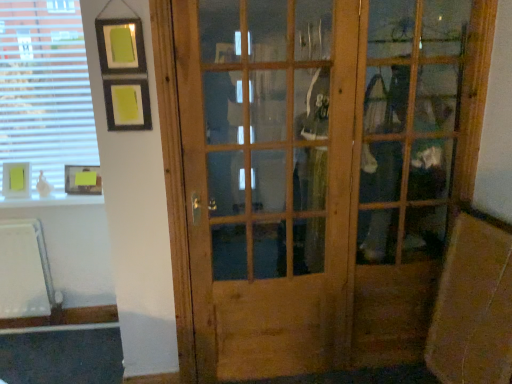
Question: Considering the positions of matte yellow picture frame at upper left, acting as the first picture frame starting from the left, and wooden door at center in the image, is matte yellow picture frame at upper left, acting as the first picture frame starting from the left, taller or shorter than wooden door at center?

Choices:
 (A) tall
 (B) short

Answer: (B)

Question: Does point (25, 183) appear closer or farther from the camera than point (452, 59)?

Choices:
 (A) farther
 (B) closer

Answer: (A)

Question: Which object is the closest to the matte yellow picture frame at upper left, placed as the second picture frame when sorted from right to left?

Choices:
 (A) white blinds at upper left
 (B) wooden door at center
 (C) yellow paper at lower left, the second picture frame positioned from the left

Answer: (C)

Question: Considering the real-world distances, which object is farthest from the white blinds at upper left?

Choices:
 (A) yellow paper at lower left, the second picture frame positioned from the left
 (B) matte yellow picture frame at upper left, placed as the second picture frame when sorted from right to left
 (C) wooden door at center

Answer: (C)